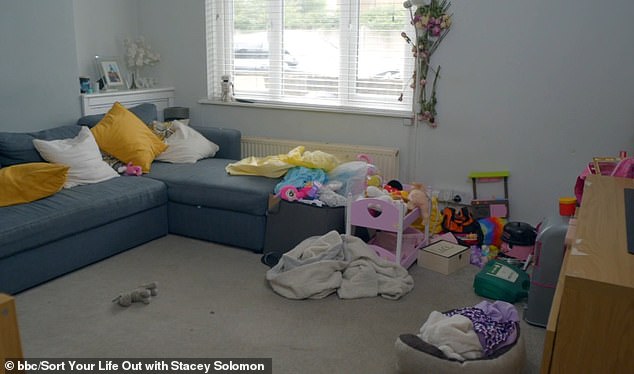
Where is `windows`? This screenshot has width=634, height=374. windows is located at coordinates (243, 46), (313, 42), (382, 42).